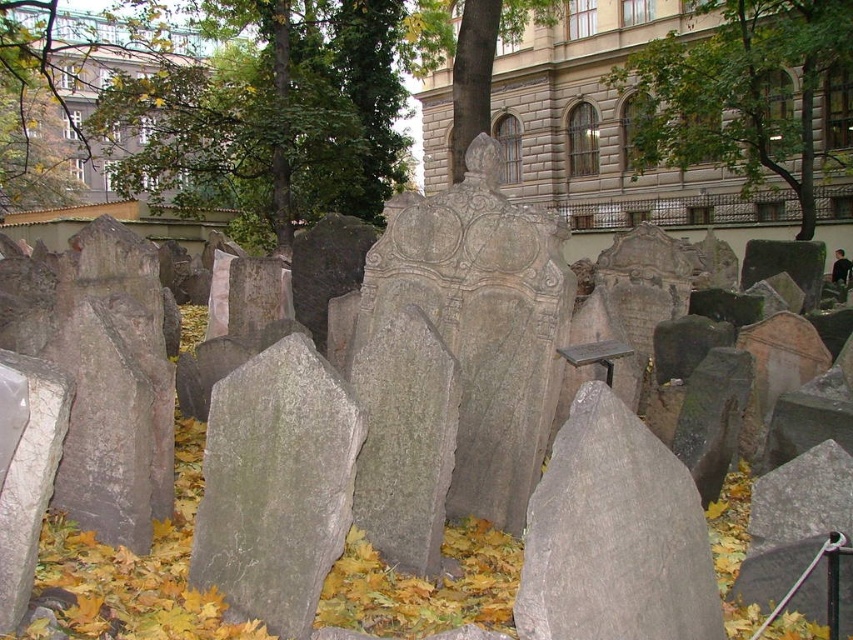
Question: Which of the following is the farthest from the observer?

Choices:
 (A) (605, 429)
 (B) (415, 52)
 (C) (666, 51)

Answer: (B)

Question: Considering the real-world distances, which object is closest to the green leafy tree at upper center?

Choices:
 (A) gray rough stone at center
 (B) green leafy tree at center

Answer: (B)

Question: Is green leafy tree at upper center positioned behind green leafy tree at center?

Choices:
 (A) yes
 (B) no

Answer: (A)

Question: Can you confirm if gray rough stone at center is positioned to the left of green leafy tree at upper center?

Choices:
 (A) yes
 (B) no

Answer: (A)

Question: Does green leafy tree at upper center appear on the right side of green leafy tree at center?

Choices:
 (A) no
 (B) yes

Answer: (B)

Question: Which point is farther to the camera?

Choices:
 (A) green leafy tree at center
 (B) gray rough stone at center

Answer: (A)